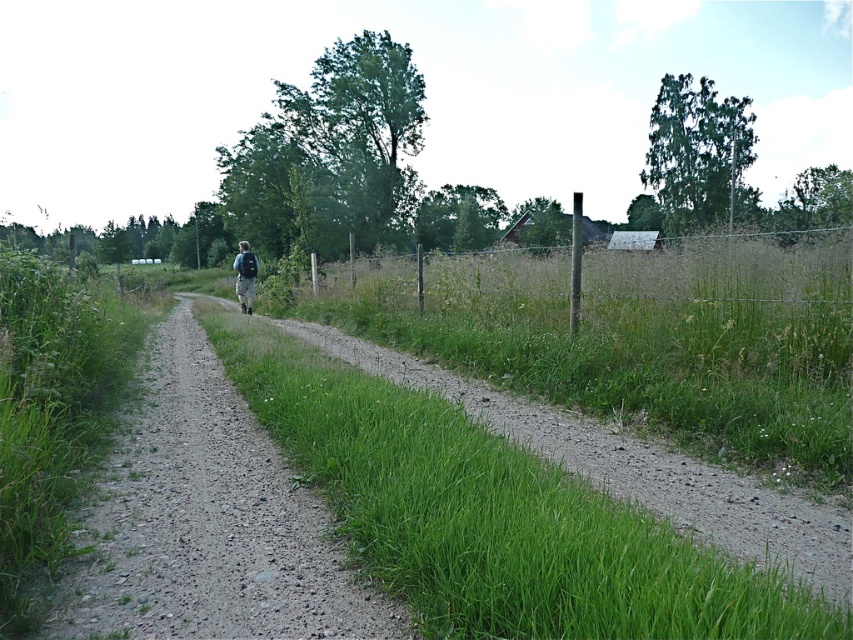
Question: Which point is closer to the camera?

Choices:
 (A) blue backpack at center
 (B) dirt/gravel path at center

Answer: (B)

Question: Among these objects, which one is farthest from the camera?

Choices:
 (A) green wire fence at center
 (B) blue backpack at center
 (C) dirt/gravel path at center

Answer: (B)

Question: Is the position of dirt/gravel path at center less distant than that of green wire fence at center?

Choices:
 (A) yes
 (B) no

Answer: (A)

Question: Does green wire fence at center appear over blue backpack at center?

Choices:
 (A) yes
 (B) no

Answer: (B)

Question: Which point is farther from the camera taking this photo?

Choices:
 (A) (236, 291)
 (B) (660, 257)
 (C) (318, 516)

Answer: (A)

Question: Is dirt/gravel path at center further to camera compared to blue backpack at center?

Choices:
 (A) yes
 (B) no

Answer: (B)